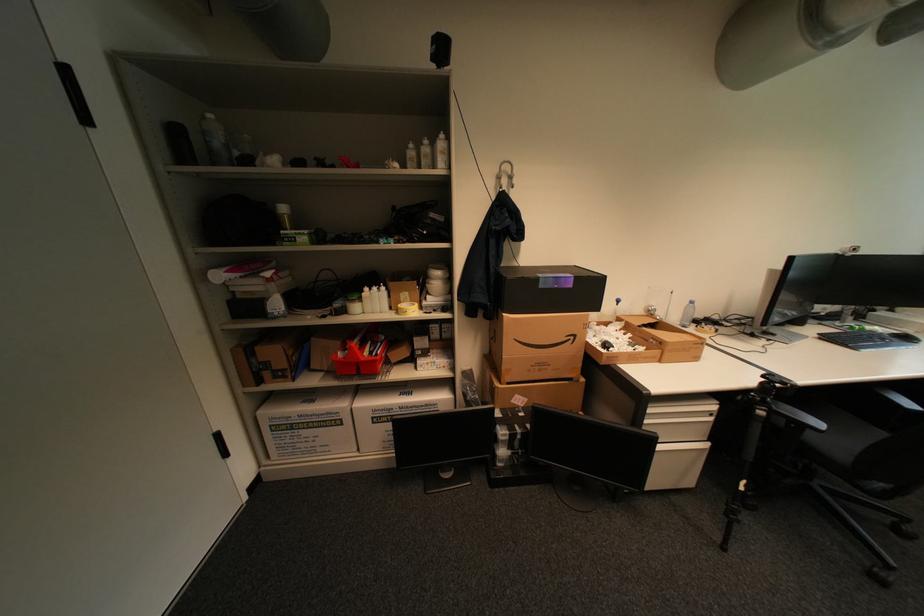
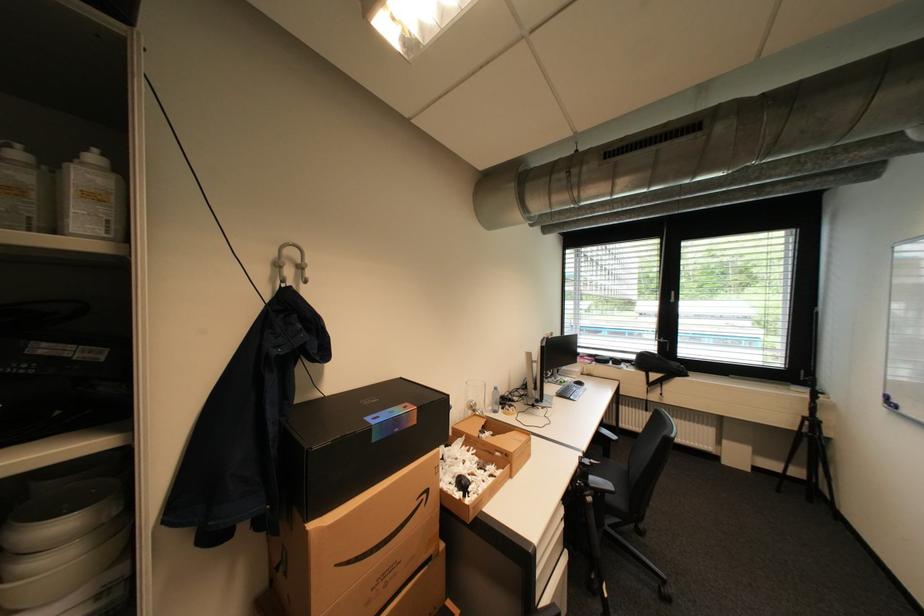
The point at (513, 182) is marked in the first image. Where is the corresponding point in the second image?

(297, 272)